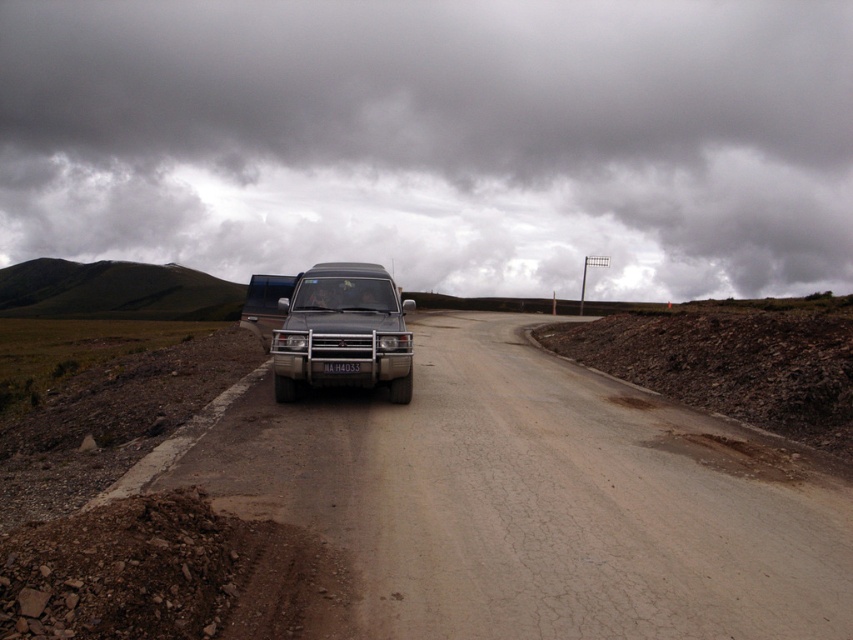
The image size is (853, 640). In order to click on matte black jeep at center in this screenshot , I will do `click(343, 332)`.

Does matte black jeep at center have a greater height compared to silver metallic jeep at center?

No, matte black jeep at center is not taller than silver metallic jeep at center.

Between point (346, 328) and point (292, 289), which one is positioned in front?

Point (346, 328) is more forward.

At what (x,y) coordinates should I click in order to perform the action: click on matte black jeep at center. Please return your answer as a coordinate pair (x, y). Looking at the image, I should click on (343, 332).